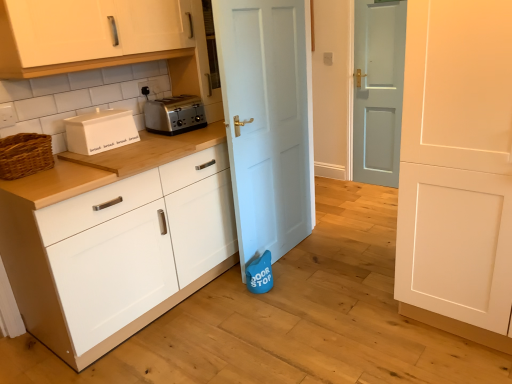
Question: In terms of height, does white matte bread bin at left look taller or shorter compared to light blue matte door at center, the 2th door positioned from the back?

Choices:
 (A) tall
 (B) short

Answer: (B)

Question: In the image, is white matte bread bin at left positioned in front of or behind light blue matte door at center, acting as the second door starting from the front?

Choices:
 (A) behind
 (B) front

Answer: (A)

Question: Estimate the real-world distances between objects in this image. Which object is farther from the woven brown basket at left?

Choices:
 (A) light blue matte door at center, the 2th door positioned from the back
 (B) white matte bread bin at left
 (C) white matte cabinet at center, the first cabinetry from the bottom
 (D) black plastic electric outlet at upper center
 (E) light blue wooden door at center, acting as the first door starting from the back

Answer: (E)

Question: Which of these objects is positioned farthest from the white glossy cabinet at upper left, which is counted as the first cabinetry, starting from the top?

Choices:
 (A) woven brown basket at left
 (B) white matte bread bin at left
 (C) light blue wooden door at center, acting as the first door starting from the back
 (D) black plastic electric outlet at upper center
 (E) white matte cabinet at center, which appears as the second cabinetry when viewed from the top

Answer: (C)